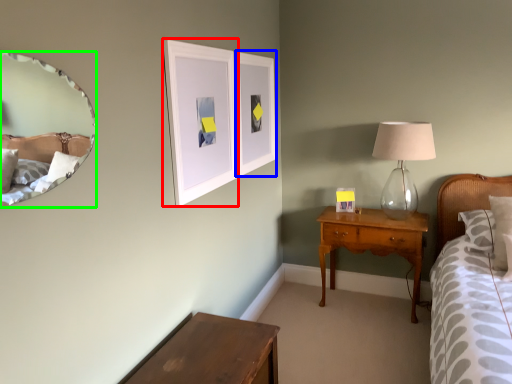
Question: Considering the real-world distances, which object is farthest from picture frame (highlighted by a red box)? picture frame (highlighted by a blue box) or mirror (highlighted by a green box)?

Choices:
 (A) picture frame
 (B) mirror

Answer: (B)